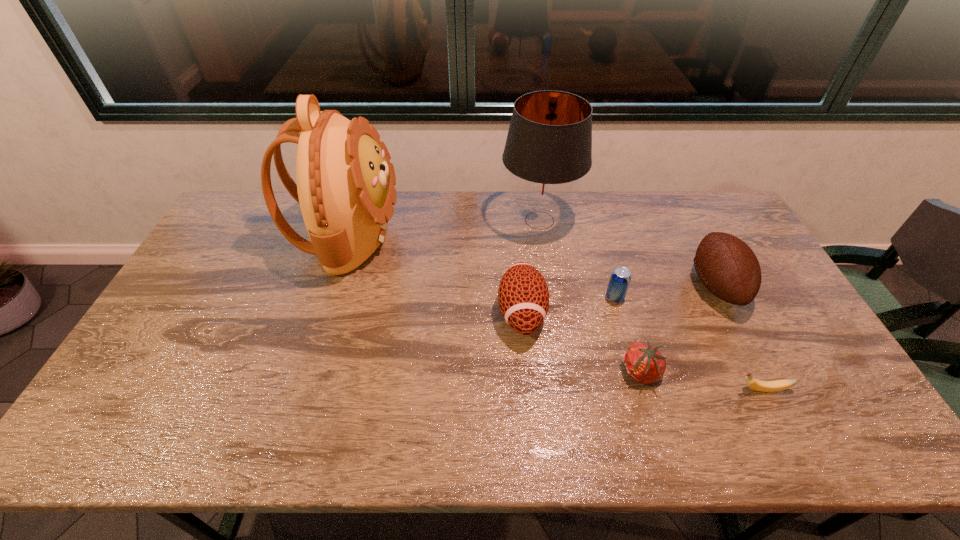
Where is `vacant space that satisfies the following two spatial constraints: 1. on the back side of the left football; 2. on the right side of the sixth shortest object`? vacant space that satisfies the following two spatial constraints: 1. on the back side of the left football; 2. on the right side of the sixth shortest object is located at coordinates pyautogui.click(x=514, y=220).

Locate an element on the screen. vacant area that satisfies the following two spatial constraints: 1. on the back side of the left football; 2. on the front-facing side of the leftmost object is located at coordinates (516, 237).